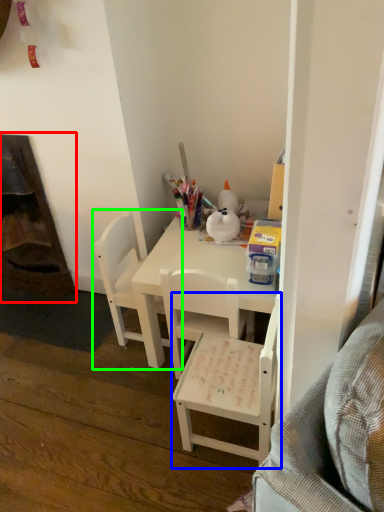
Question: Considering the real-world distances, which object is closest to fireplace (highlighted by a red box)? chair (highlighted by a blue box) or chair (highlighted by a green box).

Choices:
 (A) chair
 (B) chair

Answer: (B)